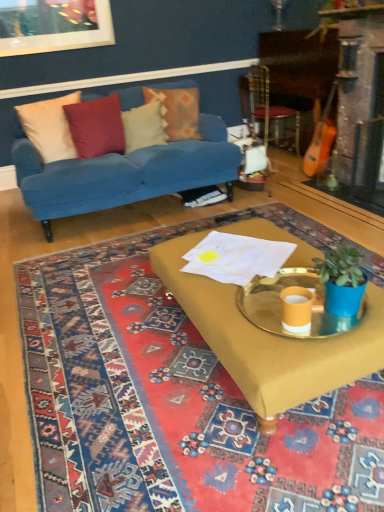
Question: Is beige fabric pillow at left, the 1th pillow viewed from the left, oriented away from blue matte plant pot at right?

Choices:
 (A) yes
 (B) no

Answer: (B)

Question: Is beige fabric pillow at left, the 1th pillow viewed from the left, shorter than blue matte plant pot at right?

Choices:
 (A) no
 (B) yes

Answer: (A)

Question: Can you confirm if beige fabric pillow at left, the 1th pillow viewed from the left, is positioned to the left of blue matte plant pot at right?

Choices:
 (A) yes
 (B) no

Answer: (A)

Question: Is beige fabric pillow at left, the 1th pillow viewed from the left, to the right of blue matte plant pot at right from the viewer's perspective?

Choices:
 (A) no
 (B) yes

Answer: (A)

Question: Is beige fabric pillow at left, positioned as the fourth pillow in right-to-left order, far from blue matte plant pot at right?

Choices:
 (A) yes
 (B) no

Answer: (A)

Question: From a real-world perspective, is metallic gold tray at center above or below beige fabric pillow at left, positioned as the fourth pillow in right-to-left order?

Choices:
 (A) above
 (B) below

Answer: (B)

Question: Is metallic gold tray at center in front of or behind beige fabric pillow at left, the 1th pillow viewed from the left, in the image?

Choices:
 (A) behind
 (B) front

Answer: (B)

Question: Would you say metallic gold tray at center is inside or outside beige fabric pillow at left, positioned as the fourth pillow in right-to-left order?

Choices:
 (A) inside
 (B) outside

Answer: (B)

Question: Considering the positions of metallic gold tray at center and beige fabric pillow at left, positioned as the fourth pillow in right-to-left order, in the image, is metallic gold tray at center wider or thinner than beige fabric pillow at left, positioned as the fourth pillow in right-to-left order,?

Choices:
 (A) wide
 (B) thin

Answer: (A)

Question: Is point (251, 308) closer or farther from the camera than point (180, 115)?

Choices:
 (A) closer
 (B) farther

Answer: (A)

Question: From a real-world perspective, relative to floral fabric pillow at upper center, the fourth pillow in the left-to-right sequence, is metallic gold tray at center vertically above or below?

Choices:
 (A) below
 (B) above

Answer: (A)

Question: Visually, is metallic gold tray at center positioned to the left or to the right of floral fabric pillow at upper center, positioned as the first pillow in right-to-left order?

Choices:
 (A) left
 (B) right

Answer: (B)

Question: Is metallic gold tray at center situated inside floral fabric pillow at upper center, the fourth pillow in the left-to-right sequence, or outside?

Choices:
 (A) outside
 (B) inside

Answer: (A)

Question: Considering the positions of point (244, 88) and point (46, 146), is point (244, 88) closer or farther from the camera than point (46, 146)?

Choices:
 (A) closer
 (B) farther

Answer: (B)

Question: Is metallic gold armchair at upper right spatially inside beige fabric pillow at left, positioned as the fourth pillow in right-to-left order, or outside of it?

Choices:
 (A) inside
 (B) outside

Answer: (B)